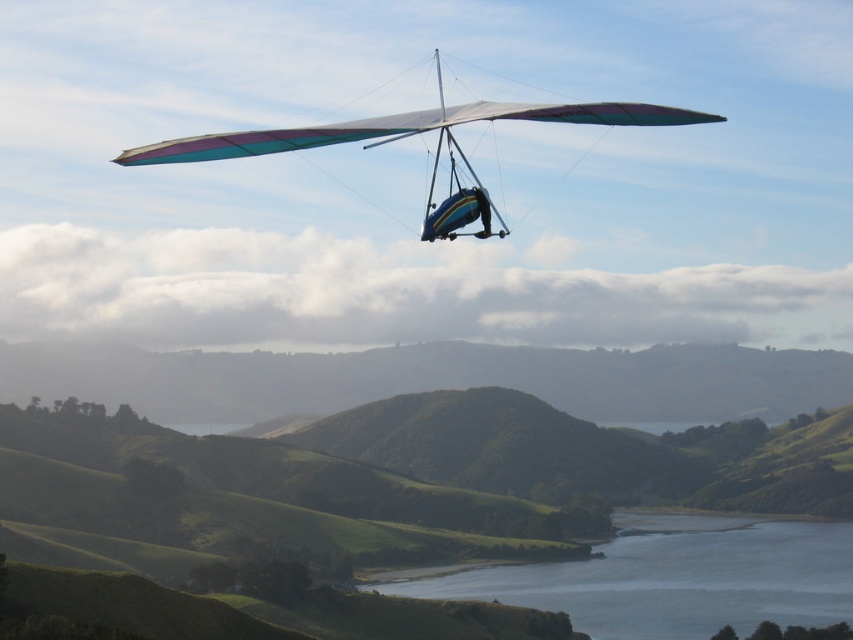
In the scene shown: You are a photographer trying to capture the rainbow fabric glider at upper center and the smooth blue water at lower center in a single shot. Based on their sizes in the image, which object should you focus on first to ensure both are in frame?

The smooth blue water at lower center has a smaller size compared to rainbow fabric glider at upper center. To ensure both are in frame, focus on the rainbow fabric glider at upper center first since it is larger and will require more attention to composition.

You are a hang glider pilot preparing to land. You see the smooth blue water at lower center and the rainbow fabric glider at upper center. Which object is located below the other?

The smooth blue water at lower center is below the rainbow fabric glider at upper center.

You are a hang glider pilot currently flying above a lake. You notice a point marked at coordinates point (670, 577). Based on the scene description, can you determine if this point is on the lake or on the surrounding hills?

The point (670, 577) is on smooth blue water at lower center, so it is on the lake.